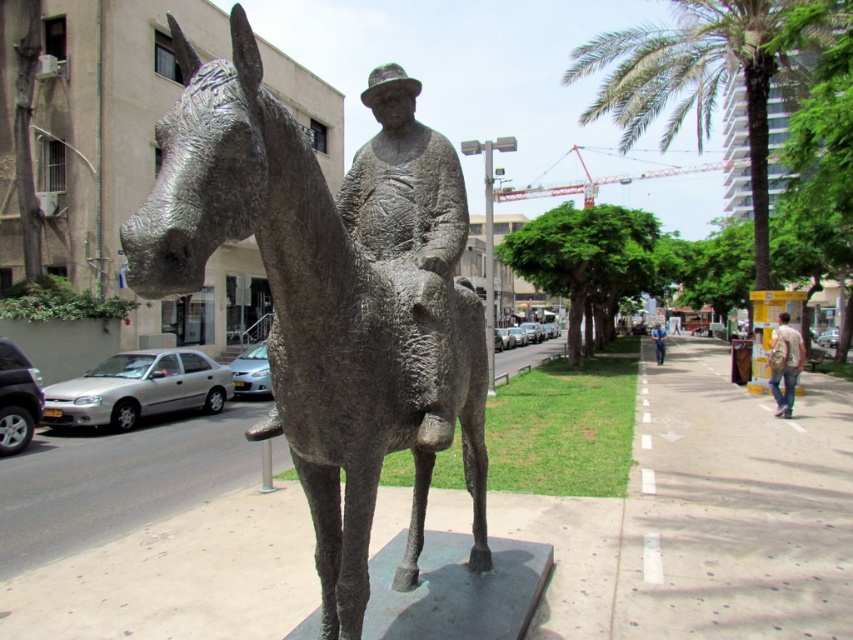
Question: Which of the following is the closest to the observer?

Choices:
 (A) (828, 600)
 (B) (776, 339)

Answer: (A)

Question: Is bronze statue at center bigger than blue denim jeans at lower right?

Choices:
 (A) yes
 (B) no

Answer: (B)

Question: Is concrete sidewalk at center thinner than blue denim jeans at lower right?

Choices:
 (A) yes
 (B) no

Answer: (A)

Question: Can you confirm if bronze statue at center is wider than blue denim jeans at lower right?

Choices:
 (A) no
 (B) yes

Answer: (A)

Question: Which point appears closest to the camera in this image?

Choices:
 (A) [x=657, y=342]
 (B) [x=440, y=332]

Answer: (B)

Question: Which object appears farthest from the camera in this image?

Choices:
 (A) concrete sidewalk at center
 (B) bronze statue at center
 (C) blue denim jeans at lower right

Answer: (C)